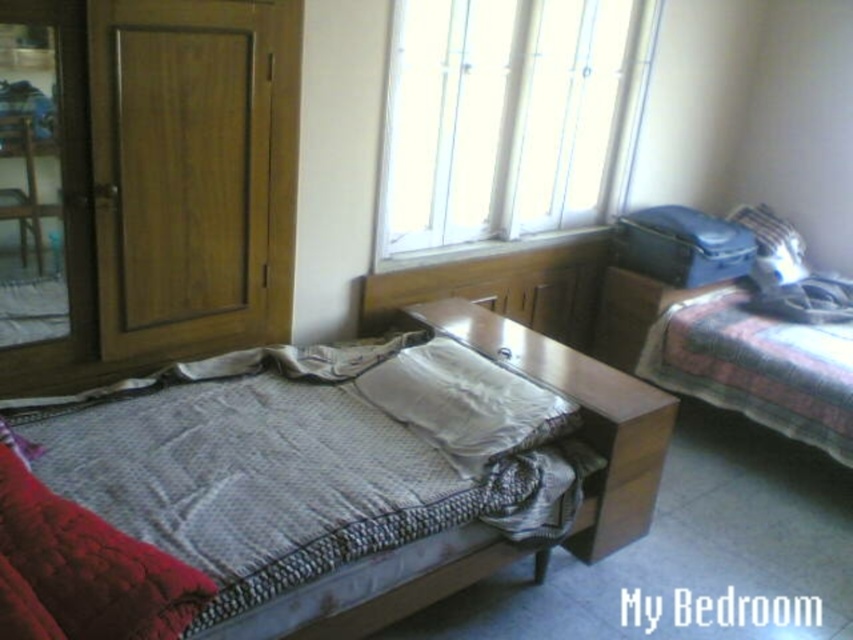
Question: Can you confirm if wooden door at left is thinner than velvet red pillow at lower left?

Choices:
 (A) no
 (B) yes

Answer: (B)

Question: Does transparent glass window at upper center have a larger size compared to white soft pillow at center?

Choices:
 (A) yes
 (B) no

Answer: (A)

Question: Estimate the real-world distances between objects in this image. Which object is farther from the patterned fabric blanket at right?

Choices:
 (A) transparent glass window at upper center
 (B) white soft pillow at center
 (C) velvet red pillow at lower left
 (D) wooden door at left

Answer: (C)

Question: Which object appears closest to the camera in this image?

Choices:
 (A) velvet red pillow at lower left
 (B) wooden door at left

Answer: (A)

Question: Estimate the real-world distances between objects in this image. Which object is farther from the white quilted bed at center?

Choices:
 (A) velvet red pillow at lower left
 (B) white soft pillow at center

Answer: (A)

Question: Is wooden door at left further to the viewer compared to velvet red pillow at lower left?

Choices:
 (A) no
 (B) yes

Answer: (B)